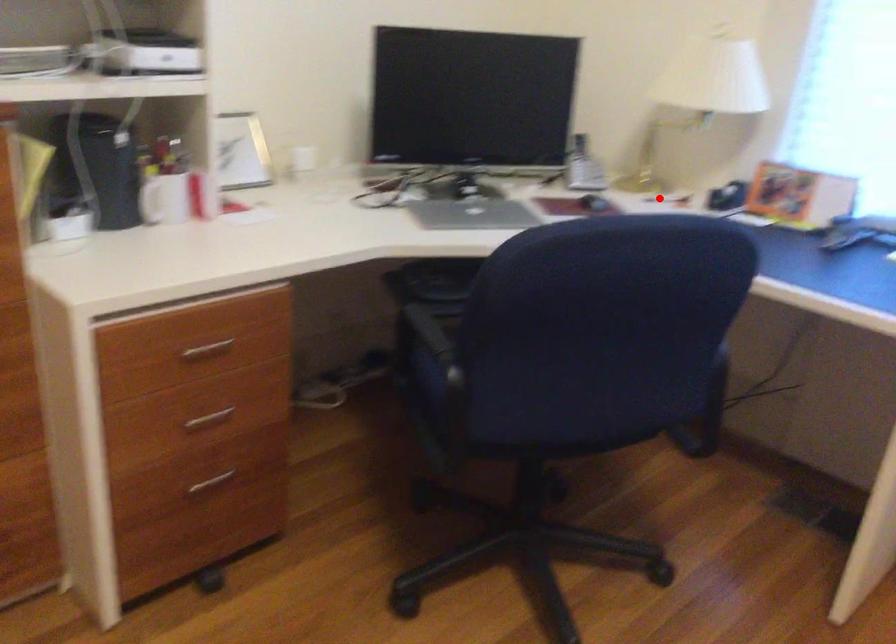
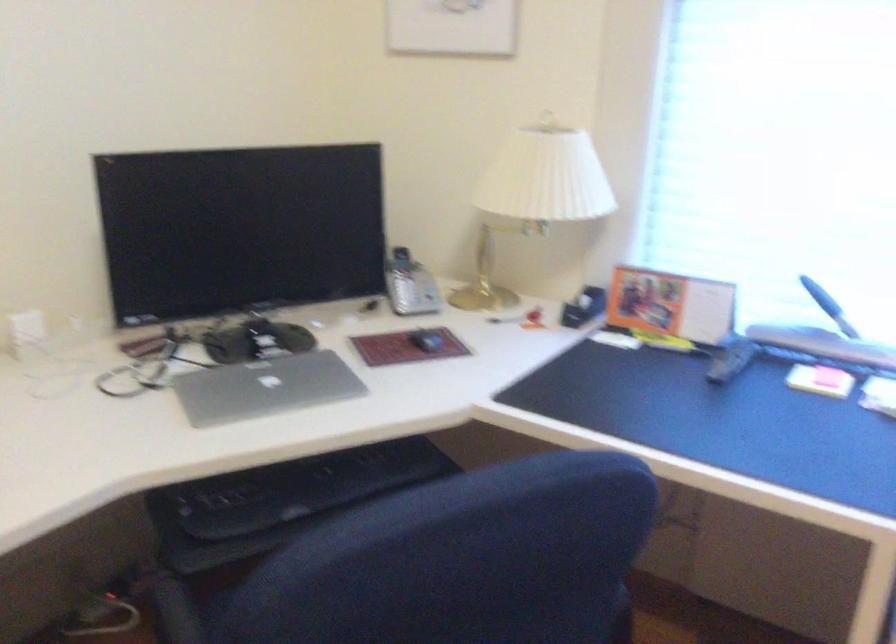
Where in the second image is the point corresponding to the highlighted location from the first image?

(504, 319)